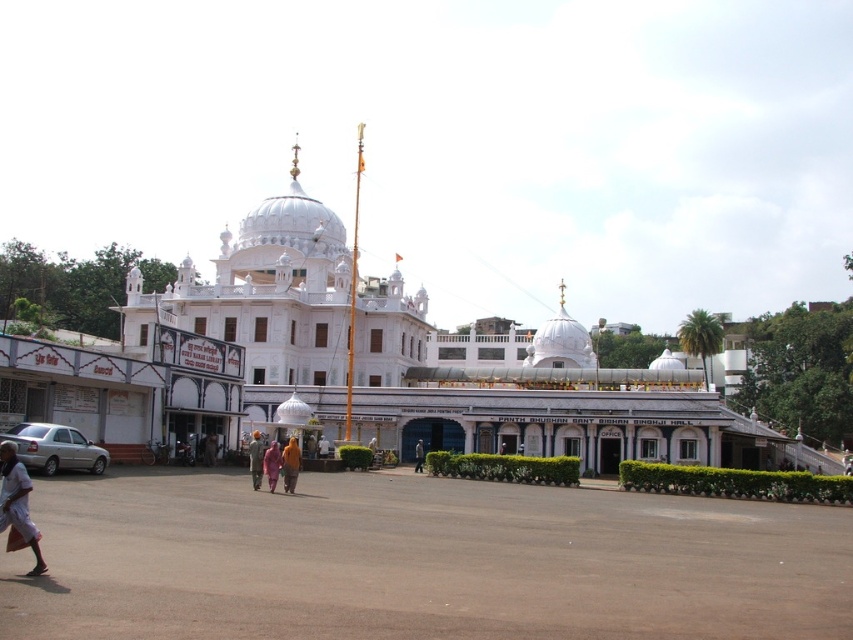
Question: Considering the relative positions of orange fabric person at center and pink fabric at center in the image provided, where is orange fabric person at center located with respect to pink fabric at center?

Choices:
 (A) right
 (B) left

Answer: (B)

Question: Which object is the farthest from the orange fabric person at center?

Choices:
 (A) light brown fabric dress at center
 (B) pink fabric at center

Answer: (B)

Question: Among these objects, which one is nearest to the camera?

Choices:
 (A) pink fabric at center
 (B) orange fabric person at center

Answer: (B)

Question: Which point is farther to the camera?

Choices:
 (A) (299, 461)
 (B) (422, 468)
 (C) (20, 472)

Answer: (B)

Question: Can you confirm if brown asphalt plaza at lower center is smaller than orange fabric person at center?

Choices:
 (A) yes
 (B) no

Answer: (B)

Question: Can you confirm if light blue fabric at lower left is bigger than light pink fabric at center?

Choices:
 (A) no
 (B) yes

Answer: (B)